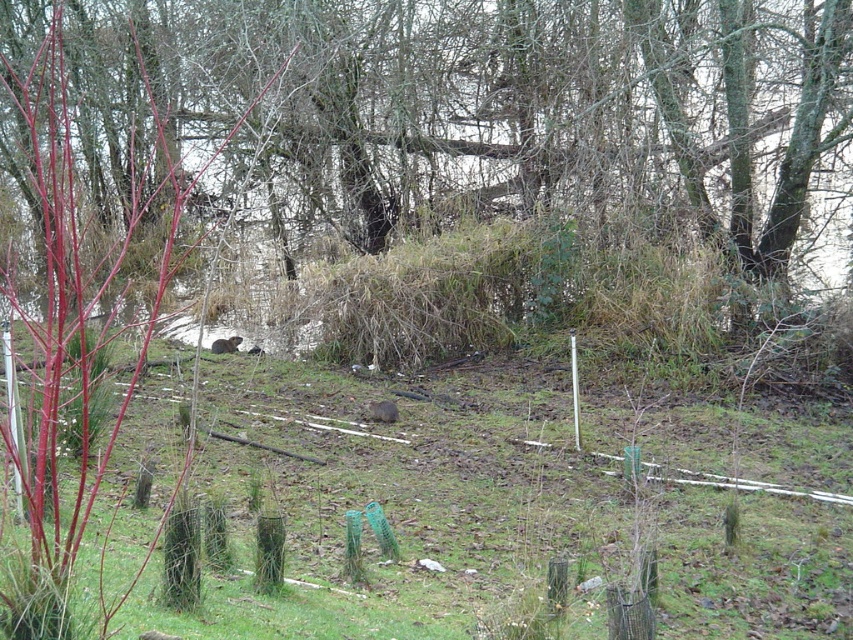
You are a gardener observing the scene and want to water the green grassy at center. Which direction should you aim the sprinkler to reach it, considering the brown grass at center is blocking the view?

The brown grass at center is above the green grassy at center, so you should aim the sprinkler below the brown grass at center to reach the green grassy at center.

You are a hiker observing the scene and want to identify the smaller animal between the brown furry rodent at center and the brown furry animal at center. Which one is shorter?

The brown furry rodent at center is not as tall as the brown furry animal at center, so the brown furry rodent at center is shorter.

You are a gardener who needs to water the brown grass at center and the green grassy at center. The watering can you have can cover an area up to 5 meters in diameter. Can you water both areas with one watering session without moving the can?

The brown grass at center and the green grassy at center are 5.51 meters apart. Since the watering can can only cover up to 5 meters in diameter, the distance between them exceeds the coverage area. Therefore, you cannot water both areas in one session without moving the can.